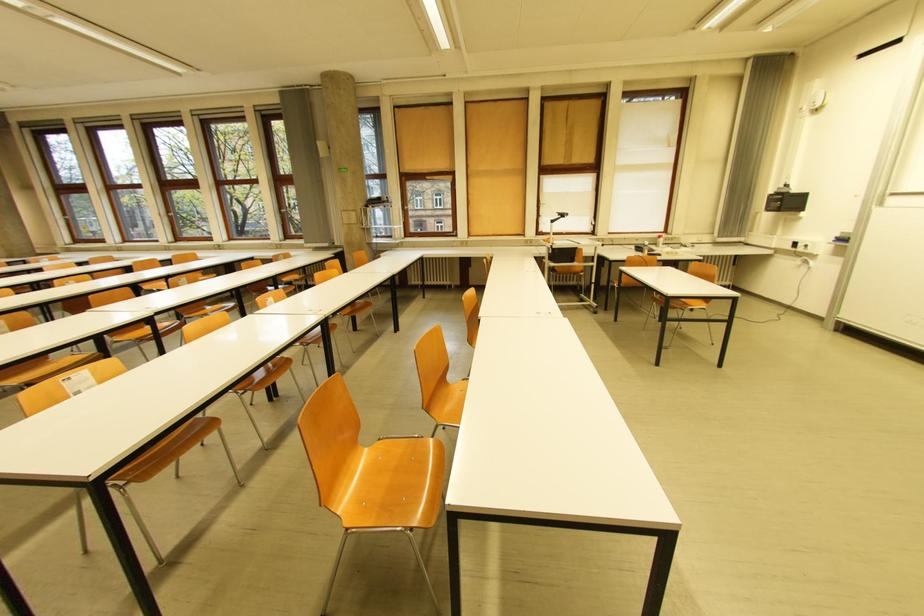
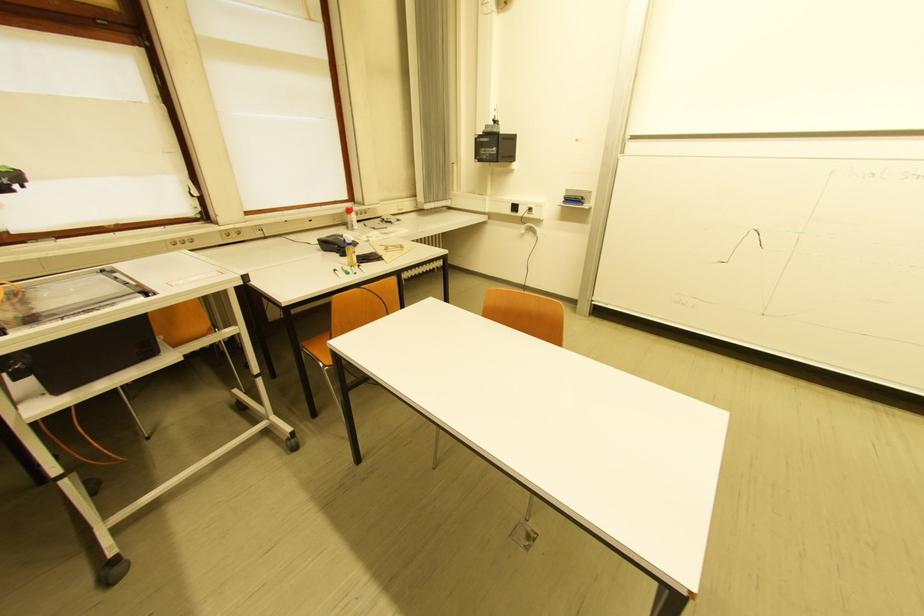
Find the pixel in the second image that matches [662,245] in the first image.

(351, 225)